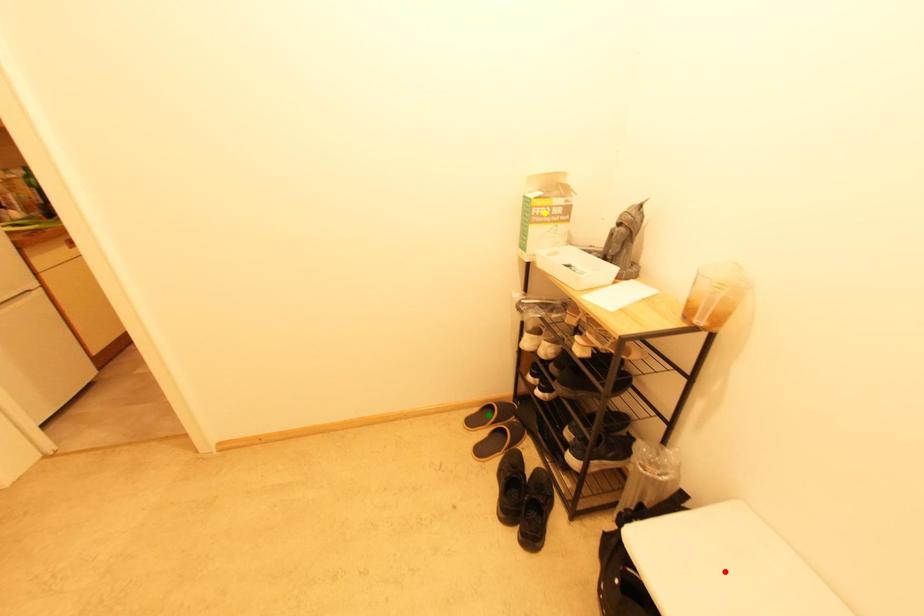
Order these from nearest to farthest:
green point, yellow point, red point

red point < yellow point < green point